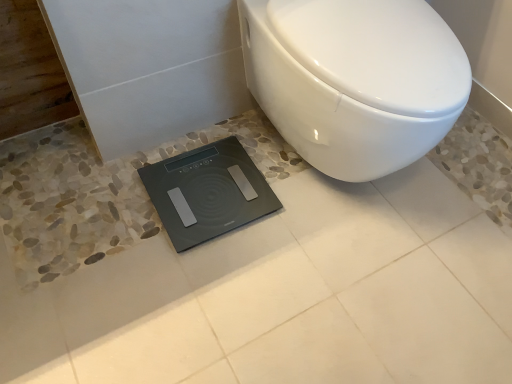
In order to click on free space on the front side of white glossy toilet at center in this screenshot , I will do `click(330, 295)`.